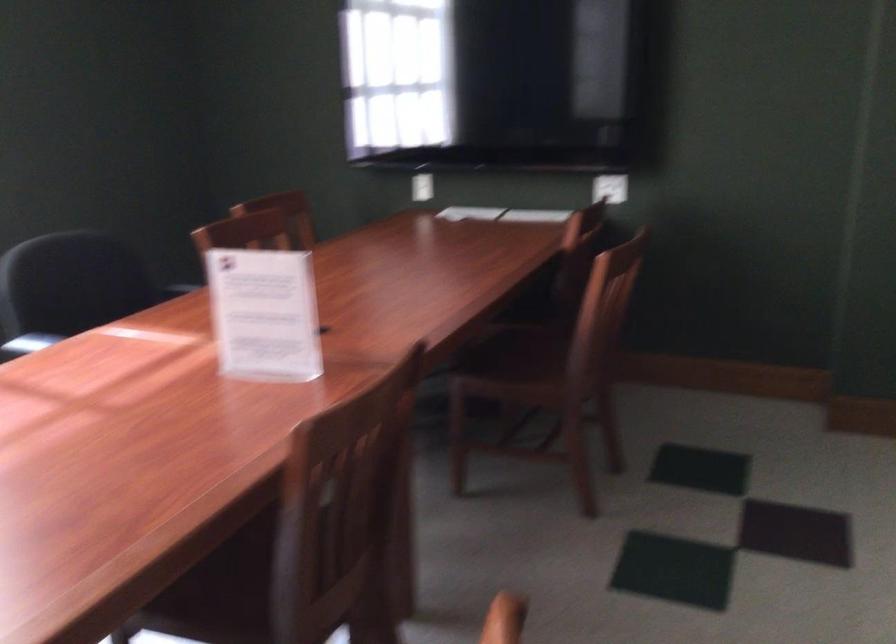
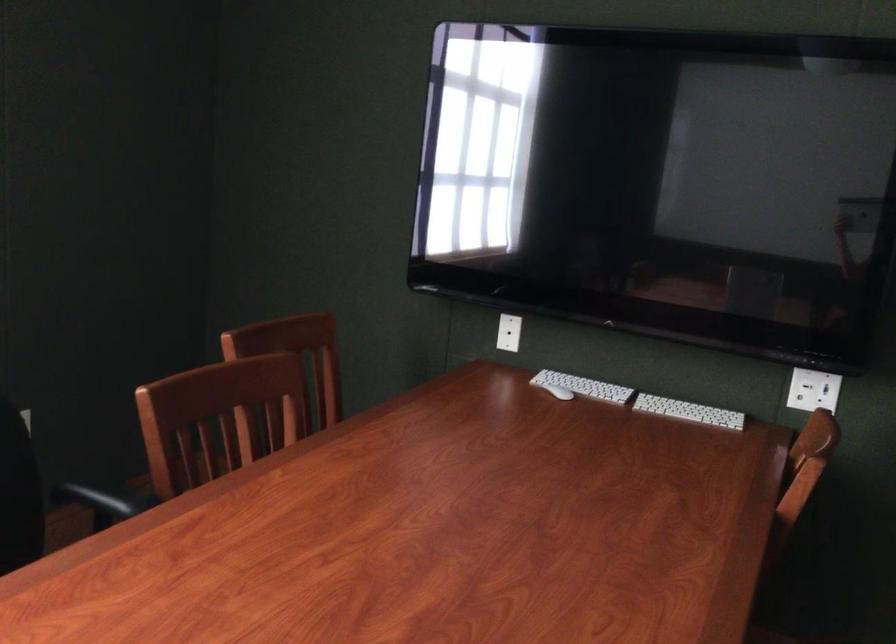
Question: In a continuous first-person perspective shot, in which direction is the camera moving?

Choices:
 (A) Left
 (B) Right
 (C) Forward
 (D) Backward

Answer: (C)